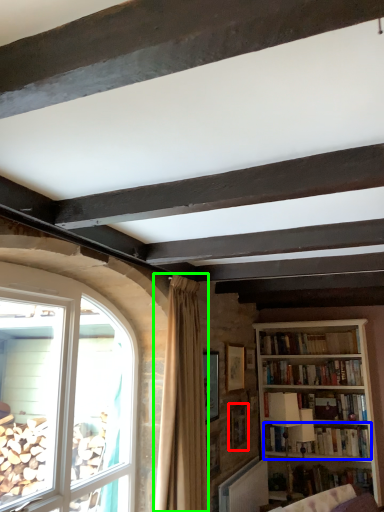
Question: Which object is the closest to the picture frame (highlighted by a red box)? Choose among these: book (highlighted by a blue box) or curtain (highlighted by a green box).

Choices:
 (A) book
 (B) curtain

Answer: (A)